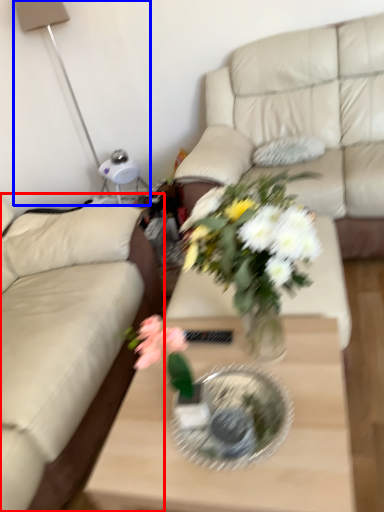
Question: Which point is further to the camera, studio couch (highlighted by a red box) or table lamp (highlighted by a blue box)?

Choices:
 (A) studio couch
 (B) table lamp

Answer: (B)